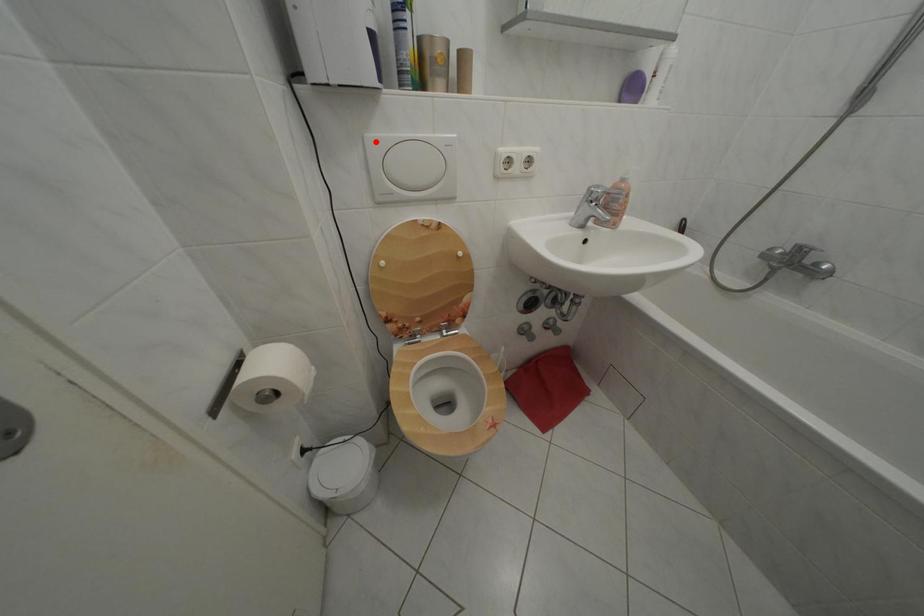
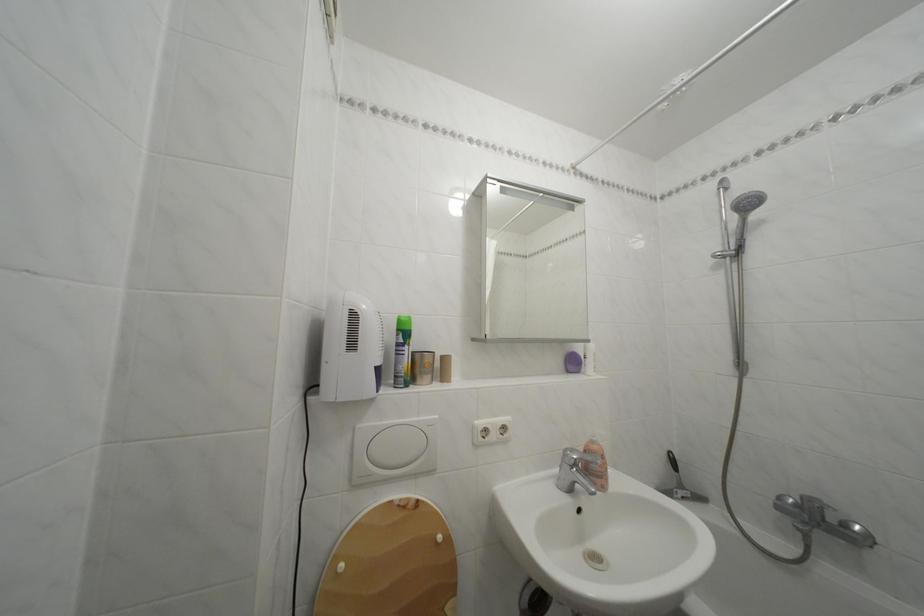
Question: I am providing you with two images of the same scene from different viewpoints. Given a red point in image1, look at the same physical point in image2. Is it:

Choices:
 (A) Closer to the viewpoint
 (B) Farther from the viewpoint

Answer: (B)